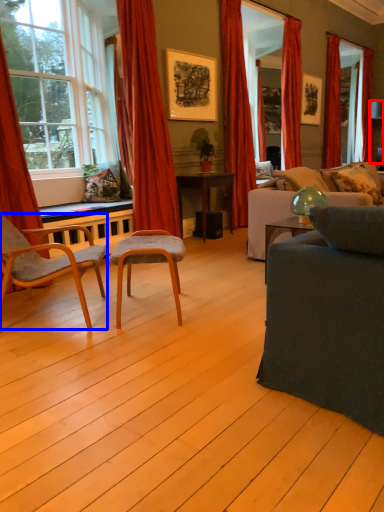
Question: Among these objects, which one is farthest to the camera, lamp (highlighted by a red box) or chair (highlighted by a blue box)?

Choices:
 (A) lamp
 (B) chair

Answer: (A)